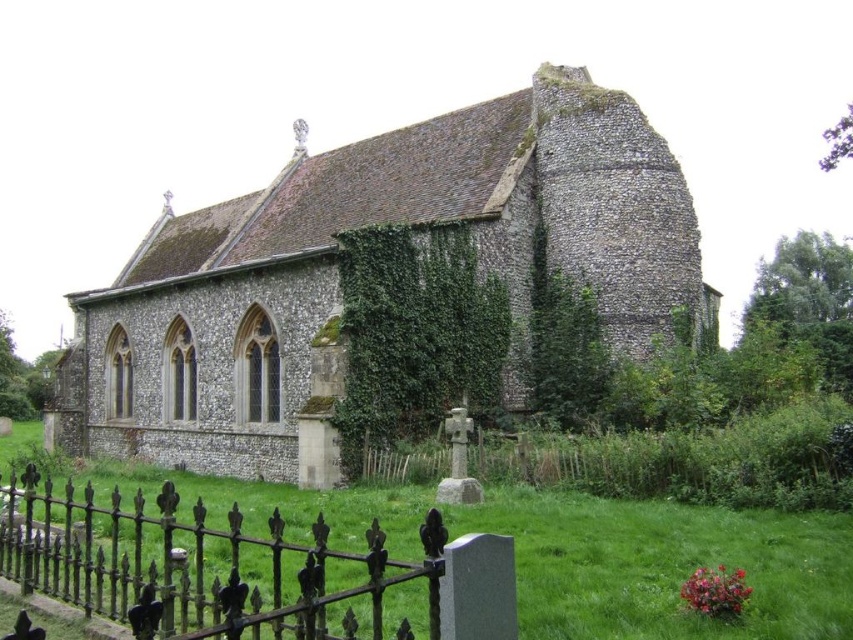
In the scene shown: Is rusty iron fence at lower left thinner than green leafy ivy at center?

No, rusty iron fence at lower left is not thinner than green leafy ivy at center.

Is rusty iron fence at lower left taller than green leafy ivy at center?

In fact, rusty iron fence at lower left may be shorter than green leafy ivy at center.

Who is more distant from viewer, (151,632) or (444,376)?

Point (444,376)

This screenshot has height=640, width=853. I want to click on rusty iron fence at lower left, so click(239, 568).

Does point (157, 390) come farther from viewer compared to point (155, 608)?

Yes, point (157, 390) is behind point (155, 608).

Does stone church at center appear on the left side of rusty iron fence at lower left?

No, stone church at center is not to the left of rusty iron fence at lower left.

What do you see at coordinates (337, 273) in the screenshot? The height and width of the screenshot is (640, 853). I see `stone church at center` at bounding box center [337, 273].

The height and width of the screenshot is (640, 853). Identify the location of stone church at center. (337, 273).

Is stone church at center to the right of green leafy ivy at center from the viewer's perspective?

Incorrect, stone church at center is not on the right side of green leafy ivy at center.

Between stone church at center and green leafy ivy at center, which one is positioned lower?

green leafy ivy at center is lower down.

Does point (177, 344) lie behind point (357, 401)?

Yes, it is behind point (357, 401).

What are the coordinates of `stone church at center` in the screenshot? It's located at (337, 273).